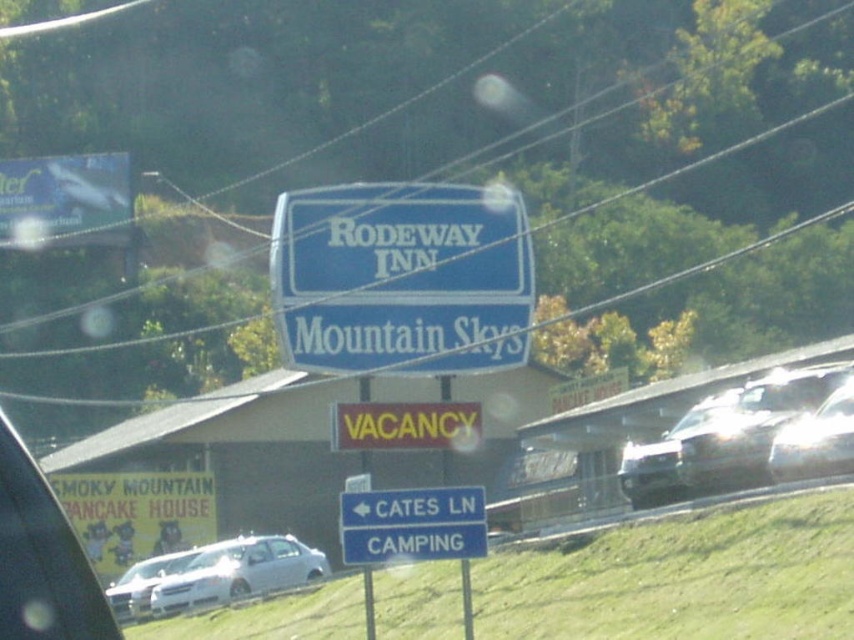
You are a driver approaching the roadside scene and see the silver metallic sedan at lower left and the blue plastic signpost at center. Which object is taller when viewed from your perspective?

The blue plastic signpost at center is taller than the silver metallic sedan at lower left.

Looking at this image, you are driving a car and want to see the blue plastic signpost at center clearly. Can you see it from your current position if the satin silver sedan at right is blocking your view?

The blue plastic signpost at center is behind the satin silver sedan at right, so it is blocked from view by the sedan.